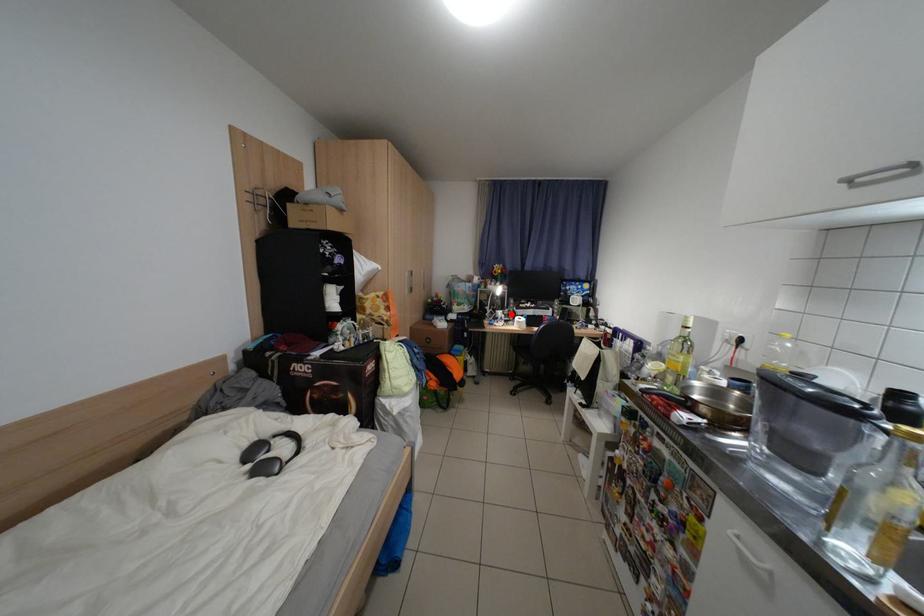
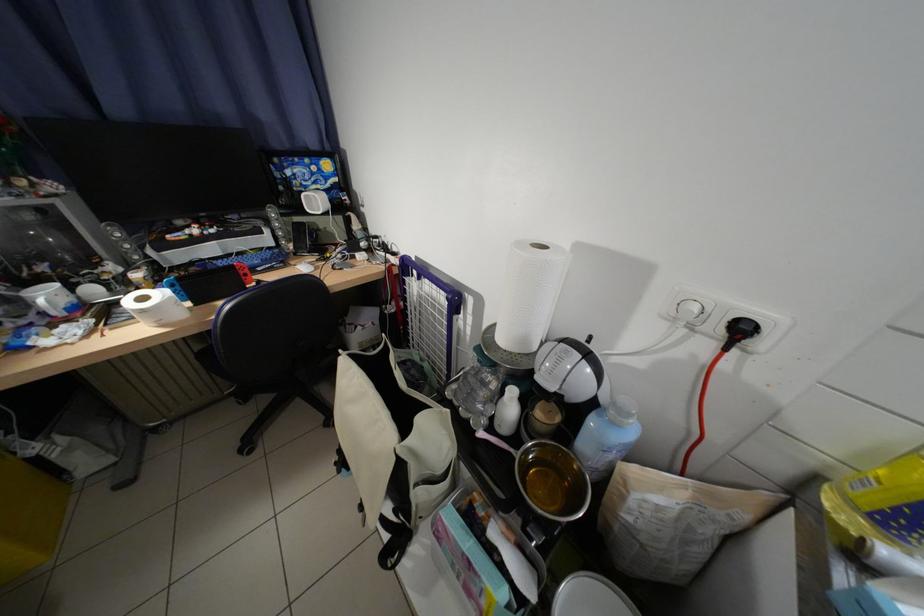
Question: I am providing you with two images of the same scene from different viewpoints. A red point is marked on the first image. Is the red point's position out of view in image 2?

Choices:
 (A) Yes
 (B) No

Answer: (B)